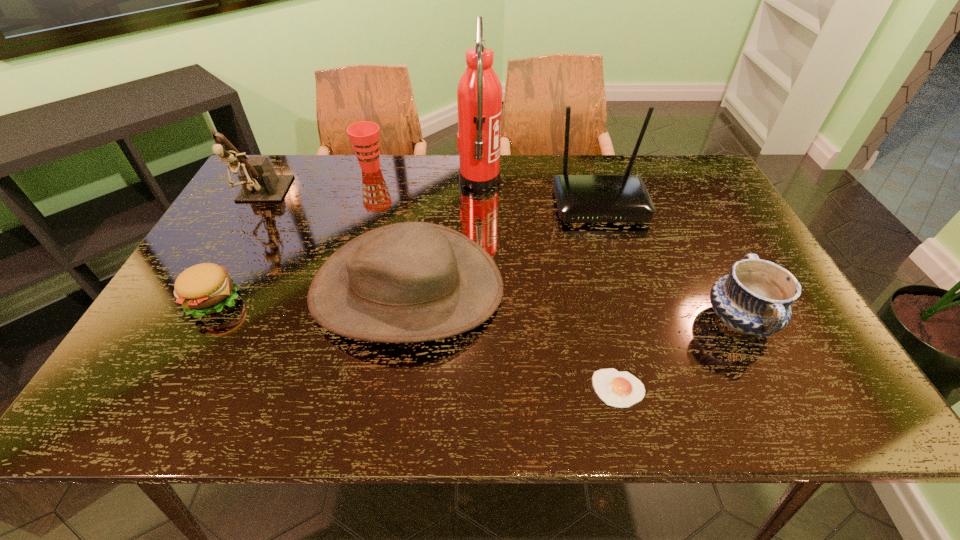
Where is `the tallest object`? This screenshot has width=960, height=540. the tallest object is located at coordinates (479, 94).

Find the location of `figurine`. figurine is located at coordinates (260, 183).

Locate an element on the screen. This screenshot has width=960, height=540. router is located at coordinates (624, 198).

At what (x,y) coordinates should I click in order to perform the action: click on cup. Please return your answer as a coordinate pair (x, y). Image resolution: width=960 pixels, height=540 pixels. Looking at the image, I should click on [x=364, y=136].

Locate an element on the screen. cowboy hat is located at coordinates (407, 282).

Where is `pottery`? pottery is located at coordinates (755, 298).

Locate an element on the screen. This screenshot has width=960, height=540. the second shortest object is located at coordinates (206, 288).

I want to click on the nearest object, so click(x=618, y=389).

The width and height of the screenshot is (960, 540). In order to click on egg yolk in this screenshot , I will do [x=618, y=389].

Identify the location of free space located on the label side of the fire extinguisher. The image size is (960, 540). (604, 181).